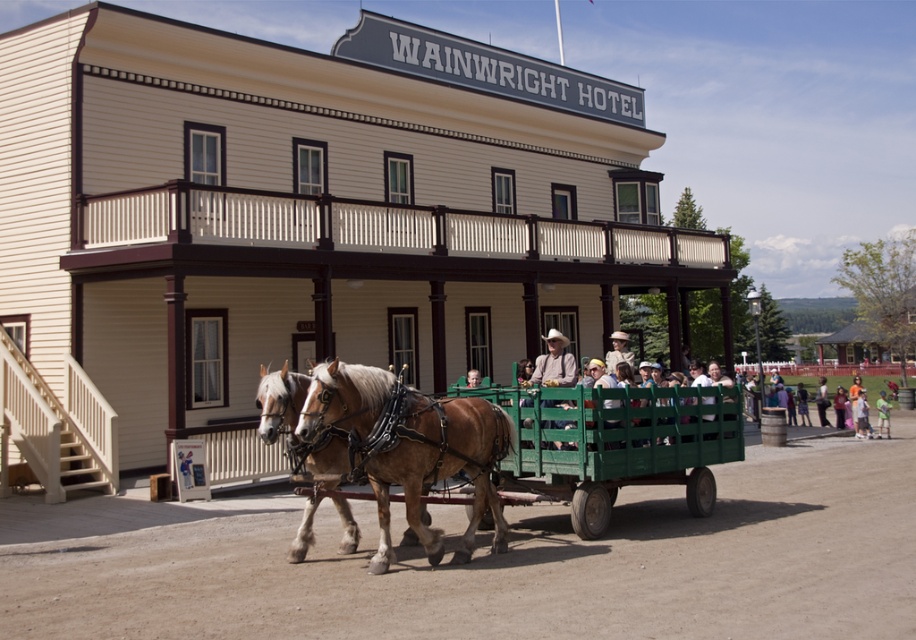
Question: Which object is the closest to the matte brown cowboy hat at center?

Choices:
 (A) light blue denim shirt at lower right
 (B) blurred cotton shirt at lower right
 (C) light brown leather horse at center
 (D) orange cotton shirt at lower right

Answer: (C)

Question: Does light brown leather horse at center lie in front of light blue denim shirt at lower right?

Choices:
 (A) yes
 (B) no

Answer: (A)

Question: Considering the relative positions of orange cotton shirt at lower right and blurred cotton shirt at lower right in the image provided, where is orange cotton shirt at lower right located with respect to blurred cotton shirt at lower right?

Choices:
 (A) below
 (B) above

Answer: (B)

Question: Is orange cotton shirt at lower right in front of blurred cotton shirt at lower right?

Choices:
 (A) no
 (B) yes

Answer: (B)

Question: Which object is the closest to the blurred cotton shirt at lower right?

Choices:
 (A) matte brown cowboy hat at center
 (B) light blue denim shirt at lower right
 (C) light brown leather horse at center
 (D) orange cotton shirt at lower right

Answer: (B)

Question: Which point is farther to the camera?

Choices:
 (A) (823, 417)
 (B) (565, 360)
 (C) (860, 419)
 (D) (480, 436)

Answer: (A)